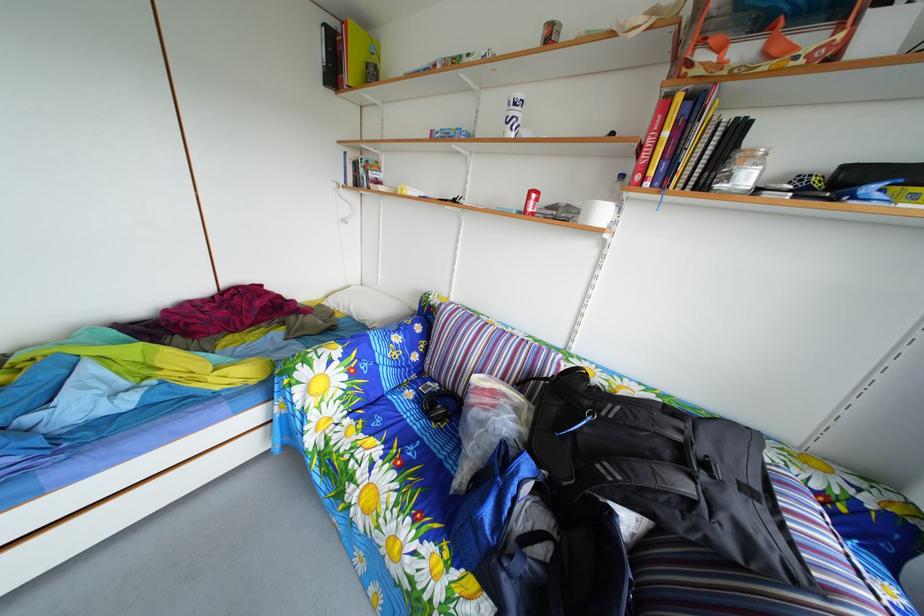
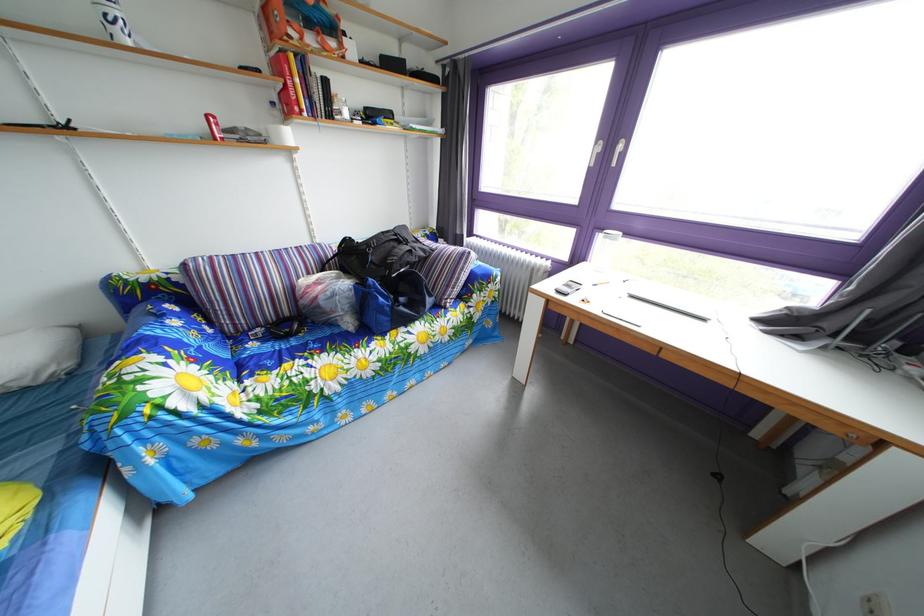
Find the pixel in the second image that matches (772,33) in the first image.

(320, 33)